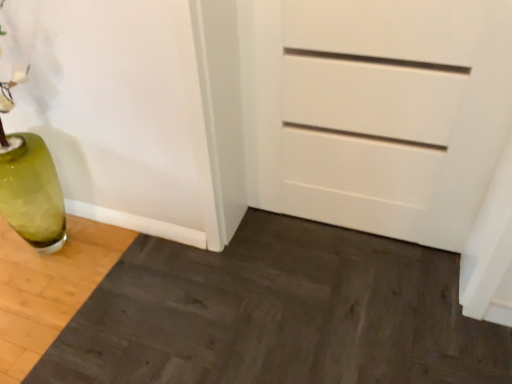
Question: Is dark wood doormat at lower left facing towards white matte chest of drawers at center?

Choices:
 (A) yes
 (B) no

Answer: (B)

Question: Does dark wood doormat at lower left have a greater width compared to white matte chest of drawers at center?

Choices:
 (A) no
 (B) yes

Answer: (B)

Question: Does dark wood doormat at lower left touch white matte chest of drawers at center?

Choices:
 (A) no
 (B) yes

Answer: (A)

Question: Considering the relative positions of dark wood doormat at lower left and white matte chest of drawers at center in the image provided, is dark wood doormat at lower left to the right of white matte chest of drawers at center from the viewer's perspective?

Choices:
 (A) no
 (B) yes

Answer: (A)

Question: Does dark wood doormat at lower left have a lesser height compared to white matte chest of drawers at center?

Choices:
 (A) yes
 (B) no

Answer: (A)

Question: Considering the relative sizes of dark wood doormat at lower left and white matte chest of drawers at center in the image provided, is dark wood doormat at lower left taller than white matte chest of drawers at center?

Choices:
 (A) no
 (B) yes

Answer: (A)

Question: Considering the relative sizes of white matte chest of drawers at center and dark wood doormat at lower left in the image provided, is white matte chest of drawers at center taller than dark wood doormat at lower left?

Choices:
 (A) yes
 (B) no

Answer: (A)

Question: Are white matte chest of drawers at center and dark wood doormat at lower left making contact?

Choices:
 (A) yes
 (B) no

Answer: (B)

Question: Is white matte chest of drawers at center oriented away from dark wood doormat at lower left?

Choices:
 (A) no
 (B) yes

Answer: (A)

Question: Does white matte chest of drawers at center appear on the left side of dark wood doormat at lower left?

Choices:
 (A) yes
 (B) no

Answer: (B)

Question: From a real-world perspective, is white matte chest of drawers at center below dark wood doormat at lower left?

Choices:
 (A) yes
 (B) no

Answer: (B)

Question: Is white matte chest of drawers at center smaller than dark wood doormat at lower left?

Choices:
 (A) no
 (B) yes

Answer: (B)

Question: From their relative heights in the image, would you say white matte chest of drawers at center is taller or shorter than dark wood doormat at lower left?

Choices:
 (A) tall
 (B) short

Answer: (A)